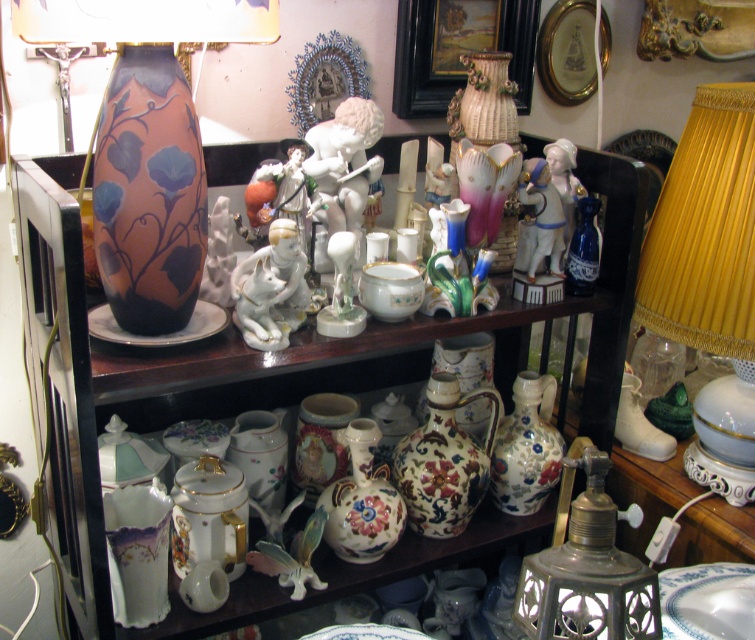
Who is more distant from viewer, [732,484] or [156,138]?

Positioned behind is point [732,484].

Who is more forward, (680, 227) or (140, 157)?

Point (140, 157)

Between point (743, 282) and point (171, 221), which one is positioned behind?

Positioned behind is point (743, 282).

Where is `gold pleated lampshade at right`? The width and height of the screenshot is (755, 640). gold pleated lampshade at right is located at coordinates 709,276.

Can you confirm if gold pleated lampshade at right is taller than metallic brass lamp at lower right?

Indeed, gold pleated lampshade at right has a greater height compared to metallic brass lamp at lower right.

Does gold pleated lampshade at right lie behind metallic brass lamp at lower right?

That is True.

Is point (723, 193) positioned behind point (596, 515)?

Yes, point (723, 193) is behind point (596, 515).

Image resolution: width=755 pixels, height=640 pixels. I want to click on gold pleated lampshade at right, so click(x=709, y=276).

Which of these two, matte ceramic vase at upper left or matte ceramic vase at center-left, stands shorter?

With less height is matte ceramic vase at center-left.

Is point (362, 572) closer to viewer compared to point (133, 48)?

That is False.

At what (x,y) coordinates should I click in order to perform the action: click on matte ceramic vase at upper left. Please return your answer as a coordinate pair (x, y). This screenshot has width=755, height=640. Looking at the image, I should click on (284, 355).